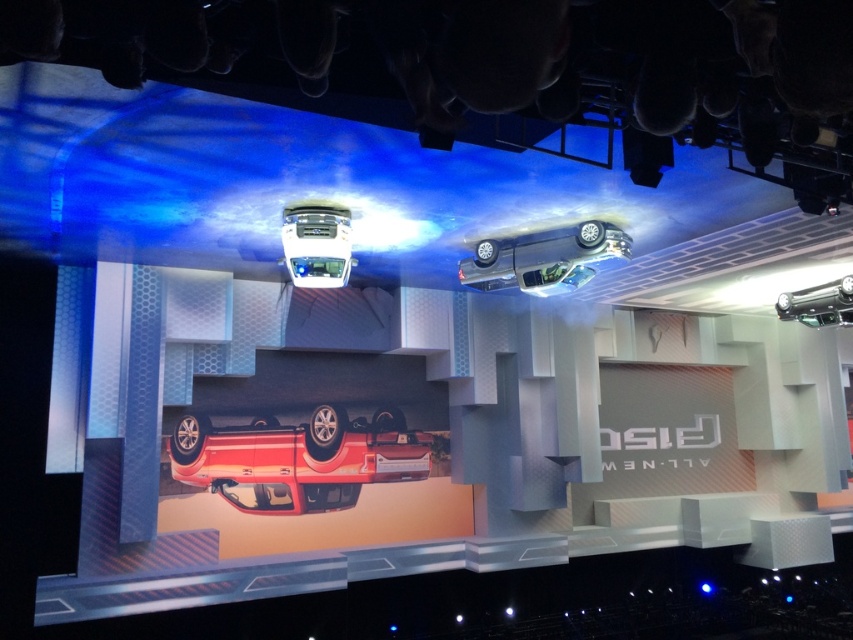
Question: Can you confirm if shiny red car at center is bigger than sleek silver car at center?

Choices:
 (A) no
 (B) yes

Answer: (B)

Question: Which object appears closest to the camera in this image?

Choices:
 (A) sleek silver car at center
 (B) satin silver car at upper center

Answer: (A)

Question: Which of these objects is positioned closest to the shiny silver car at center?

Choices:
 (A) sleek silver car at center
 (B) satin silver car at upper center

Answer: (B)

Question: Does sleek silver car at center come behind shiny silver car at center?

Choices:
 (A) no
 (B) yes

Answer: (A)

Question: Is shiny red car at center below satin silver car at upper center?

Choices:
 (A) no
 (B) yes

Answer: (B)

Question: Which object appears closest to the camera in this image?

Choices:
 (A) shiny red car at center
 (B) sleek silver car at center

Answer: (B)